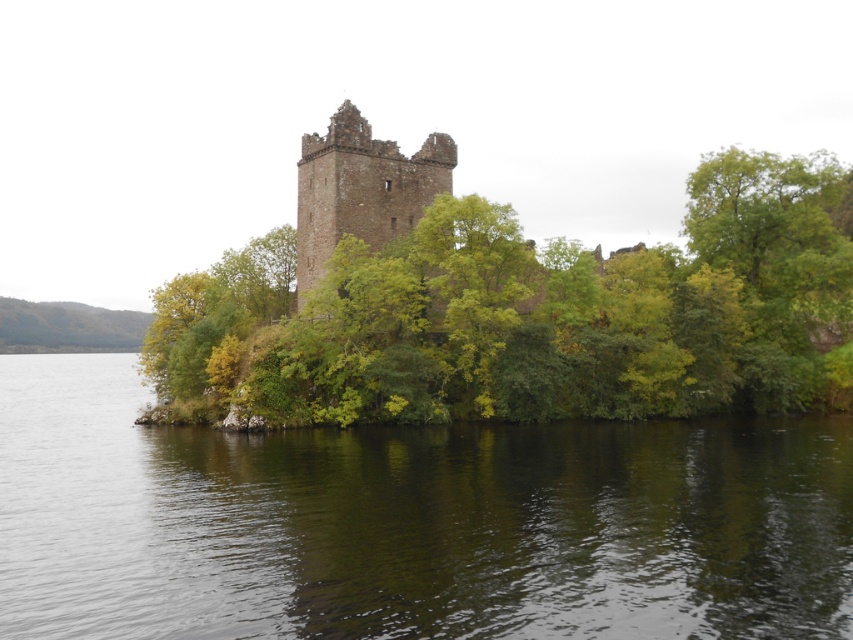
Question: Considering the relative positions of dark green water at center and brown stone tower at center in the image provided, where is dark green water at center located with respect to brown stone tower at center?

Choices:
 (A) left
 (B) right

Answer: (A)

Question: Can you confirm if green leafy tree at center is wider than brown stone tower at center?

Choices:
 (A) yes
 (B) no

Answer: (A)

Question: Which point appears farthest from the camera in this image?

Choices:
 (A) (683, 493)
 (B) (693, 244)
 (C) (299, 259)

Answer: (C)

Question: Which object is positioned closest to the dark green water at center?

Choices:
 (A) green leafy tree at center
 (B) brown stone tower at center

Answer: (A)

Question: Can you confirm if dark green water at center is positioned below brown stone tower at center?

Choices:
 (A) yes
 (B) no

Answer: (A)

Question: Which object is positioned closest to the green leafy tree at center?

Choices:
 (A) brown stone tower at center
 (B) dark green water at center

Answer: (A)